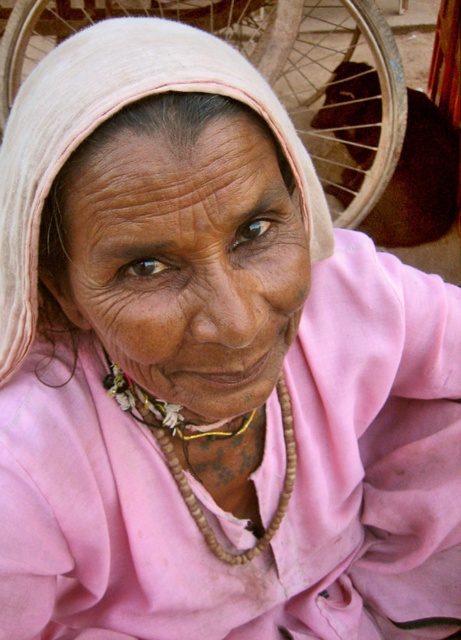
Question: From the image, what is the correct spatial relationship of brown matte face at center in relation to wooden beads at center?

Choices:
 (A) left
 (B) right

Answer: (A)

Question: From the image, what is the correct spatial relationship of brown matte face at center in relation to wooden beads at center?

Choices:
 (A) above
 (B) below

Answer: (A)

Question: Which point appears closest to the camera in this image?

Choices:
 (A) (282, 381)
 (B) (124, 205)

Answer: (B)

Question: Observing the image, what is the correct spatial positioning of brown matte face at center in reference to wooden beads at center?

Choices:
 (A) left
 (B) right

Answer: (A)